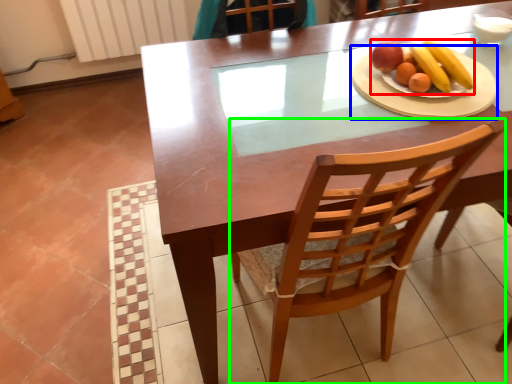
Question: Estimate the real-world distances between objects in this image. Which object is farther from fruit dish (highlighted by a red box), platter (highlighted by a blue box) or chair (highlighted by a green box)?

Choices:
 (A) platter
 (B) chair

Answer: (B)